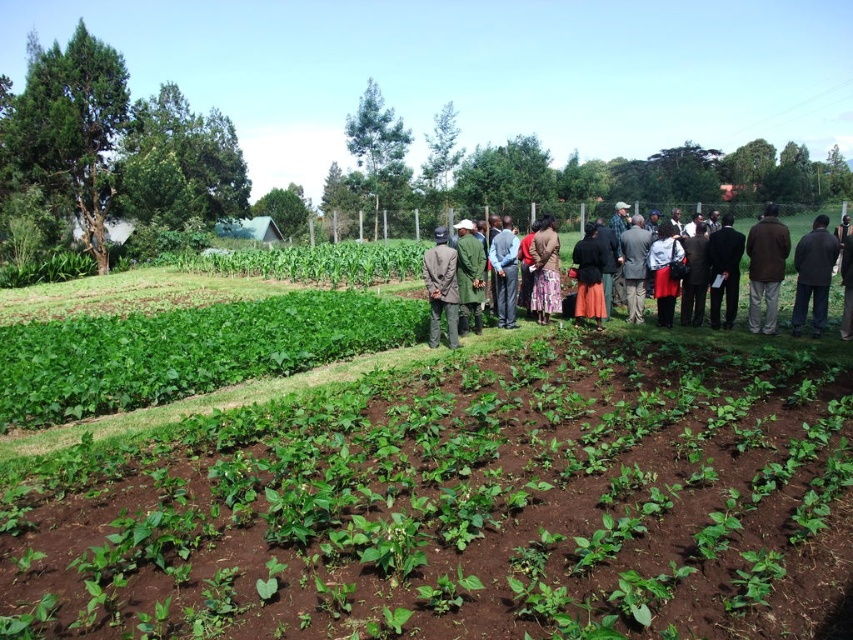
How much distance is there between matte black dress at center and dark gray fabric jacket at center?

matte black dress at center and dark gray fabric jacket at center are 4.31 feet apart from each other.

Who is taller, matte black dress at center or dark gray fabric jacket at center?

dark gray fabric jacket at center

Between point (595, 246) and point (498, 278), which one is positioned in front?

Point (595, 246)

In order to click on matte black dress at center in this screenshot , I will do `click(589, 276)`.

Who is positioned more to the left, brown fabric skirt at center or dark gray suit at center?

From the viewer's perspective, brown fabric skirt at center appears more on the left side.

Is point (556, 269) more distant than point (635, 236)?

Yes, point (556, 269) is behind point (635, 236).

Does point (544, 292) come farther from viewer compared to point (631, 221)?

No, it is not.

The height and width of the screenshot is (640, 853). In order to click on brown fabric skirt at center in this screenshot , I will do `click(544, 269)`.

Is point (784, 264) less distant than point (450, 310)?

No, (784, 264) is further to viewer.

Is point (750, 300) closer to viewer compared to point (444, 294)?

No.

Find the location of `brown wool coat at right`. brown wool coat at right is located at coordinates (764, 268).